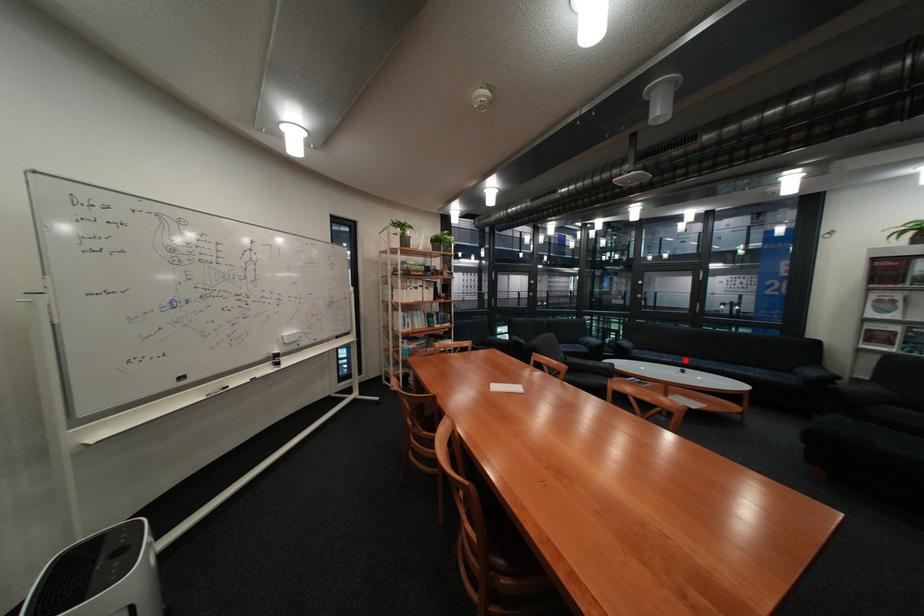
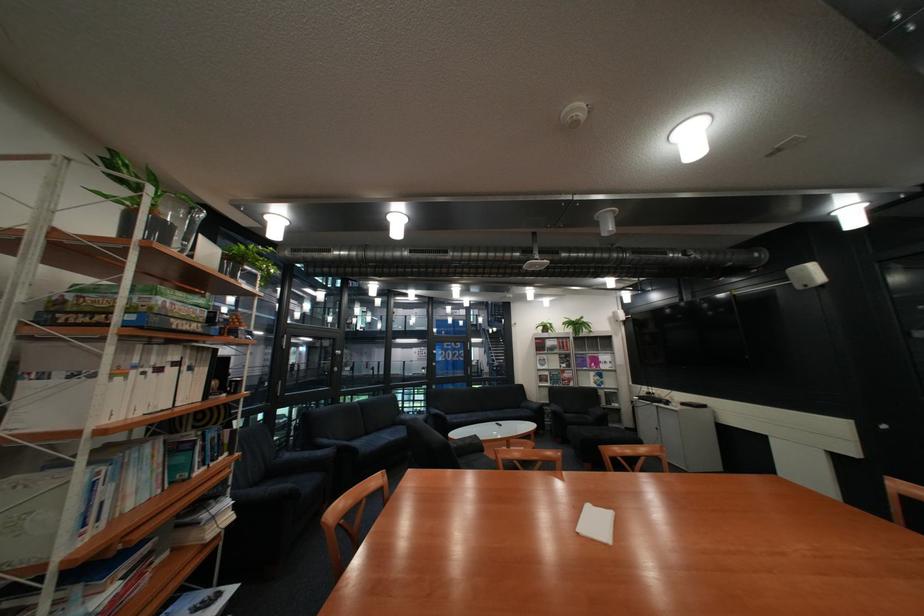
Locate, in the second image, the point that corresponds to the highlighted location in the first image.

(490, 418)